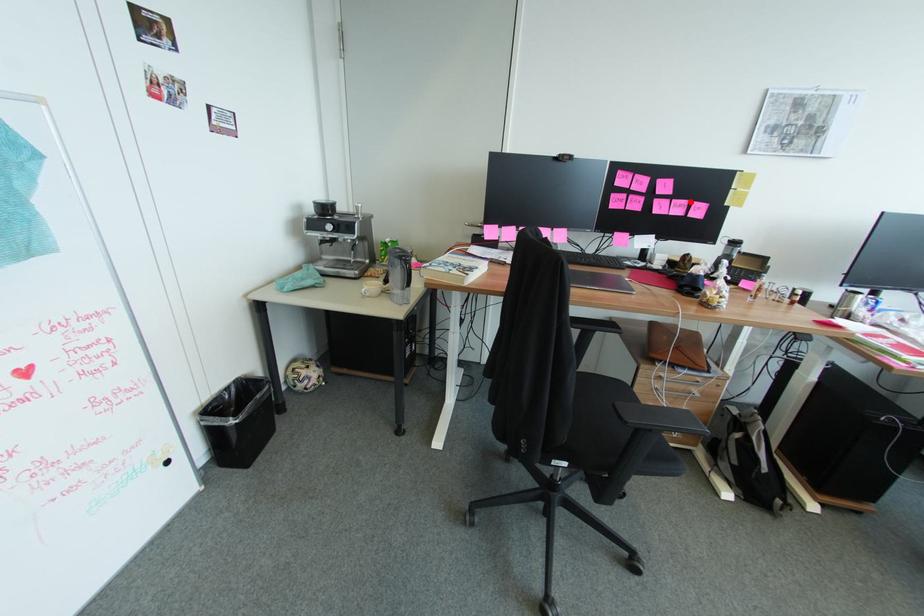
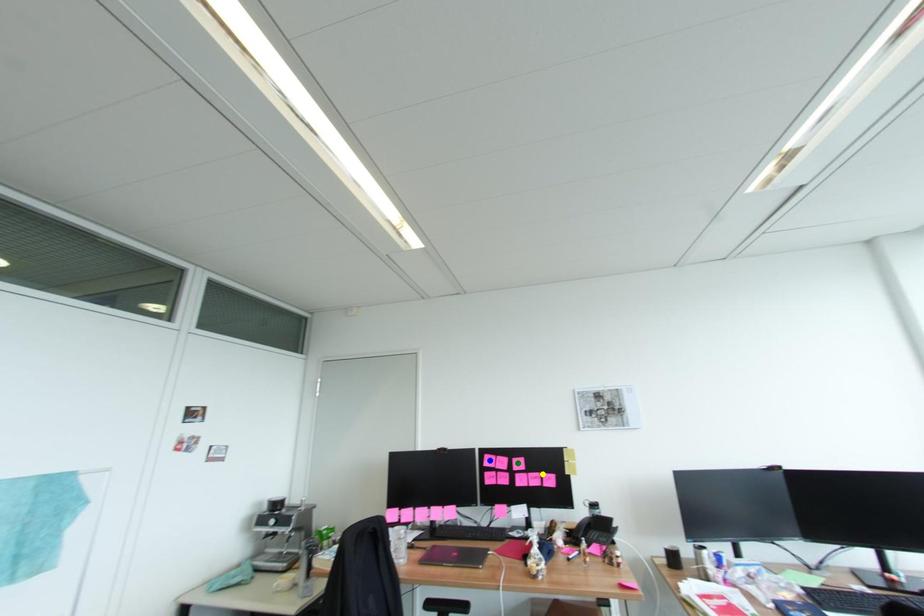
Question: I am providing you with two images of the same scene from different viewpoints. A red point is marked on the first image. You are given multiple points on the second image. Which spot in image 2 lines up with the point in image 1?

Choices:
 (A) blue point
 (B) yellow point
 (C) green point

Answer: (B)